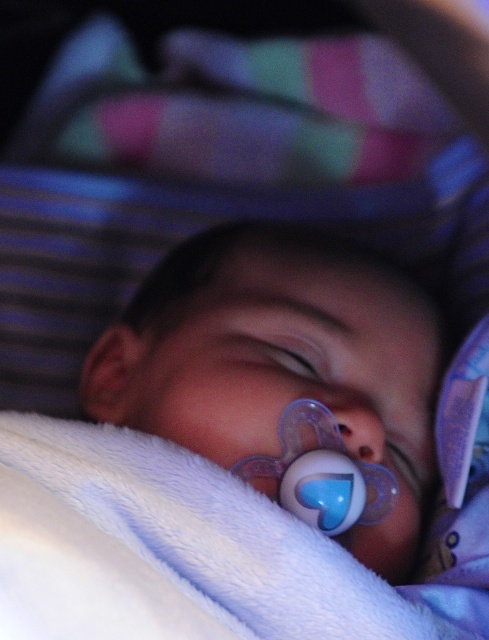
Which of these two, translucent plastic pacifier at center or white fluffy blanket at lower left, stands taller?

translucent plastic pacifier at center

Is point (280, 497) positioned in front of point (308, 576)?

No, (280, 497) is behind (308, 576).

The height and width of the screenshot is (640, 489). What are the coordinates of `translucent plastic pacifier at center` in the screenshot? It's located at (285, 378).

Is white fluffy blanket at lower left thinner than transparent plastic pacifier at lower center?

No, white fluffy blanket at lower left is not thinner than transparent plastic pacifier at lower center.

Which of these two, white fluffy blanket at lower left or transparent plastic pacifier at lower center, stands shorter?

transparent plastic pacifier at lower center

Does point (67, 449) come closer to viewer compared to point (306, 520)?

Yes.

Where is `white fluffy blanket at lower left`? This screenshot has width=489, height=640. white fluffy blanket at lower left is located at coordinates (177, 550).

Image resolution: width=489 pixels, height=640 pixels. What do you see at coordinates (285, 378) in the screenshot?
I see `translucent plastic pacifier at center` at bounding box center [285, 378].

Can you confirm if translucent plastic pacifier at center is wider than transparent plastic pacifier at lower center?

Yes, translucent plastic pacifier at center is wider than transparent plastic pacifier at lower center.

Where is `translucent plastic pacifier at center`? The width and height of the screenshot is (489, 640). translucent plastic pacifier at center is located at coordinates (285, 378).